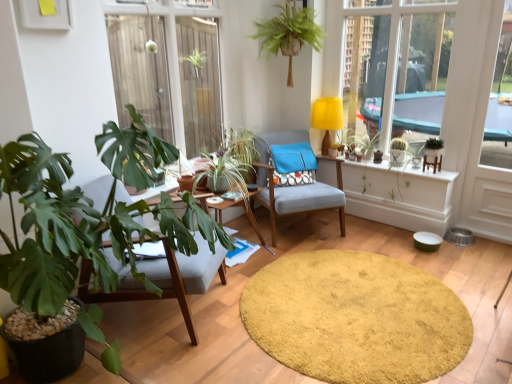
Locate an element on the screen. The width and height of the screenshot is (512, 384). free space to the back side of matte black pot at center is located at coordinates (370, 152).